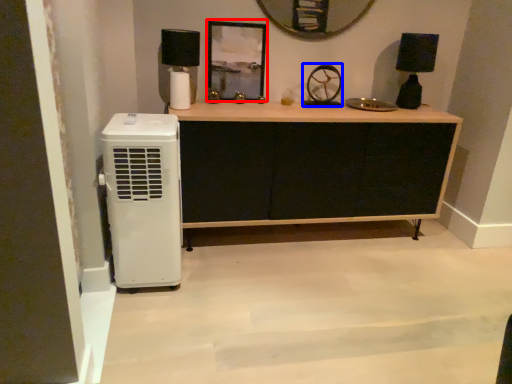
Question: Which of the following is the farthest to the observer, picture frame (highlighted by a red box) or wheel (highlighted by a blue box)?

Choices:
 (A) picture frame
 (B) wheel

Answer: (B)